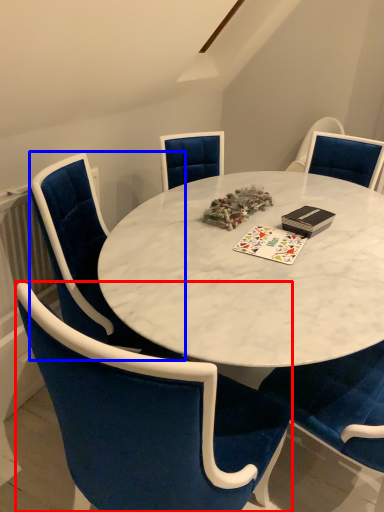
Question: Which object appears closest to the camera in this image, chair (highlighted by a red box) or chair (highlighted by a blue box)?

Choices:
 (A) chair
 (B) chair

Answer: (A)